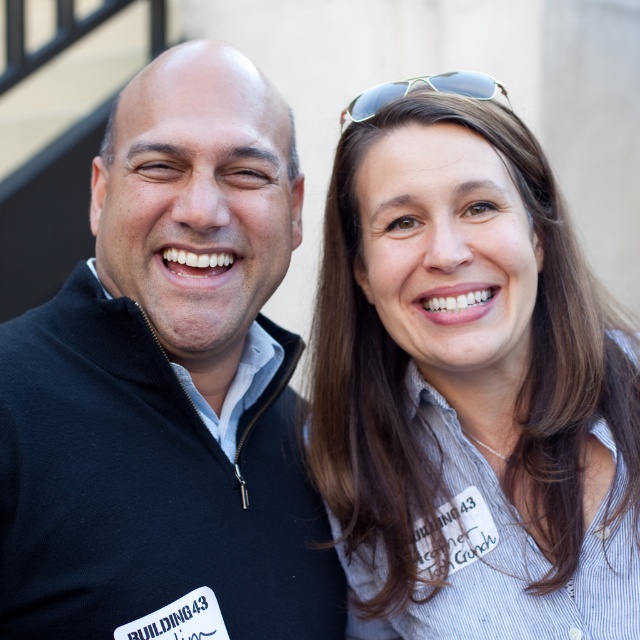
Is point (401, 154) behind point (435, 76)?

No, (401, 154) is closer to viewer.

Can you confirm if striped shirt at center is bigger than sunglasses at upper center?

Correct, striped shirt at center is larger in size than sunglasses at upper center.

What are the coordinates of `striped shirt at center` in the screenshot? It's located at (468, 384).

Find the location of a particular element. Image resolution: width=640 pixels, height=640 pixels. striped shirt at center is located at coordinates (468, 384).

Who is more forward, (372,406) or (278,166)?

Point (278,166) is more forward.

Who is shorter, striped shirt at center or black fleece at left?

striped shirt at center is shorter.

Is point (532, 461) behind point (54, 595)?

Yes, point (532, 461) is farther from viewer.

This screenshot has width=640, height=640. I want to click on striped shirt at center, so click(x=468, y=384).

In the scene shown: Is black fleece at left above sunglasses at upper center?

Incorrect, black fleece at left is not positioned above sunglasses at upper center.

Where is `black fleece at left`? This screenshot has width=640, height=640. black fleece at left is located at coordinates click(168, 387).

This screenshot has width=640, height=640. In order to click on black fleece at left in this screenshot , I will do 168,387.